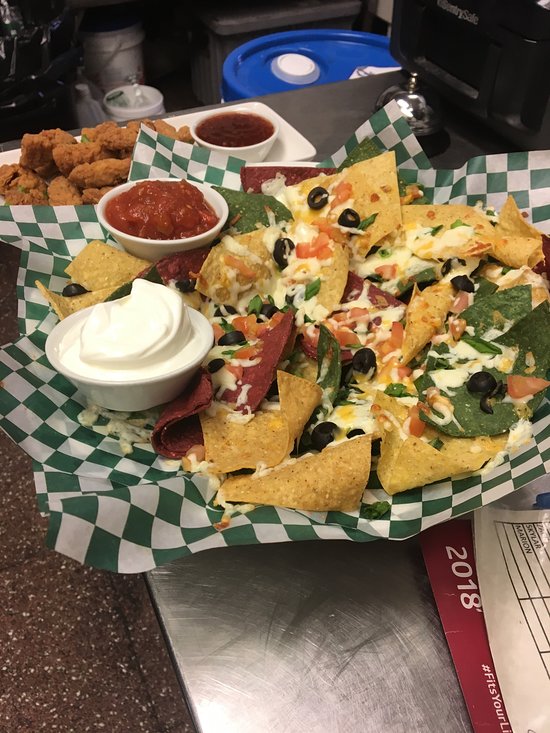
You are a GUI agent. You are given a task and a screenshot of the screen. Output one action in this format:
    pyautogui.click(x=<x>, y=<y>)
    Task: Click on the small kitchen appliance on the top right
    The image size is (550, 733).
    Given the screenshot: What is the action you would take?
    (x=462, y=48)